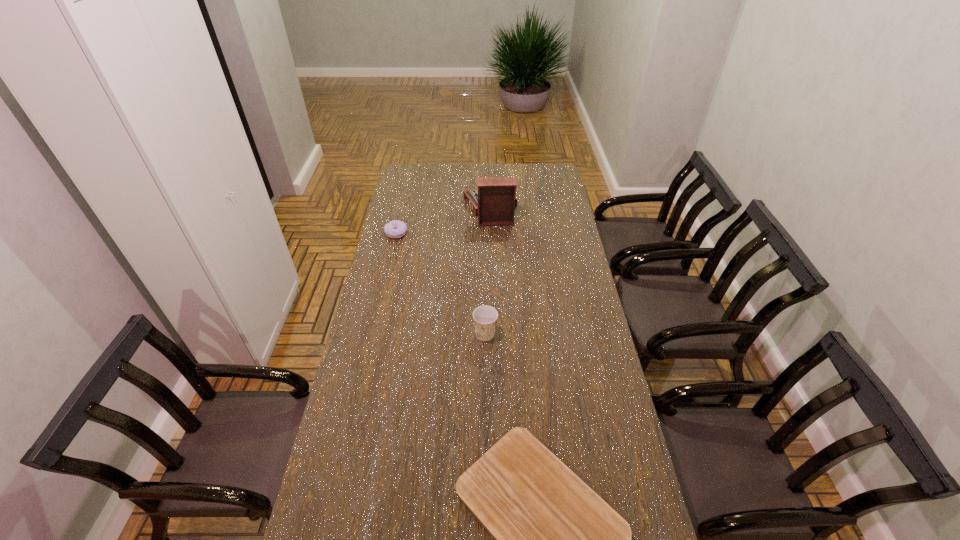
Locate an element on the screen. This screenshot has width=960, height=540. the tallest object is located at coordinates (493, 202).

Image resolution: width=960 pixels, height=540 pixels. I want to click on the third shortest object, so click(485, 317).

The image size is (960, 540). What are the coordinates of `Dixie cup` in the screenshot? It's located at (485, 317).

Locate an element on the screen. The width and height of the screenshot is (960, 540). doughnut is located at coordinates (394, 229).

Locate an element on the screen. The image size is (960, 540). the third tallest object is located at coordinates (394, 229).

The height and width of the screenshot is (540, 960). I want to click on blank space located 0.390m on the front of the phonograph record, so click(492, 286).

The height and width of the screenshot is (540, 960). Identify the location of free space located on the back of the third farthest object. (485, 273).

I want to click on vacant point located 0.370m on the back of the leftmost object, so click(x=407, y=185).

You are a GUI agent. You are given a task and a screenshot of the screen. Output one action in this format:
    pyautogui.click(x=<x>, y=<y>)
    Task: Click on the object at the left edge
    Image resolution: width=960 pixels, height=540 pixels.
    Given the screenshot: What is the action you would take?
    pyautogui.click(x=394, y=229)

Locate an element on the screen. vacant area at the far edge of the desktop is located at coordinates (468, 167).